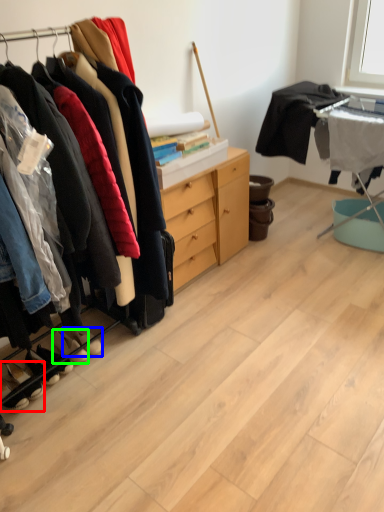
Question: Which is farther away from footwear (highlighted by a red box)? footwear (highlighted by a blue box) or footwear (highlighted by a green box)?

Choices:
 (A) footwear
 (B) footwear

Answer: (A)